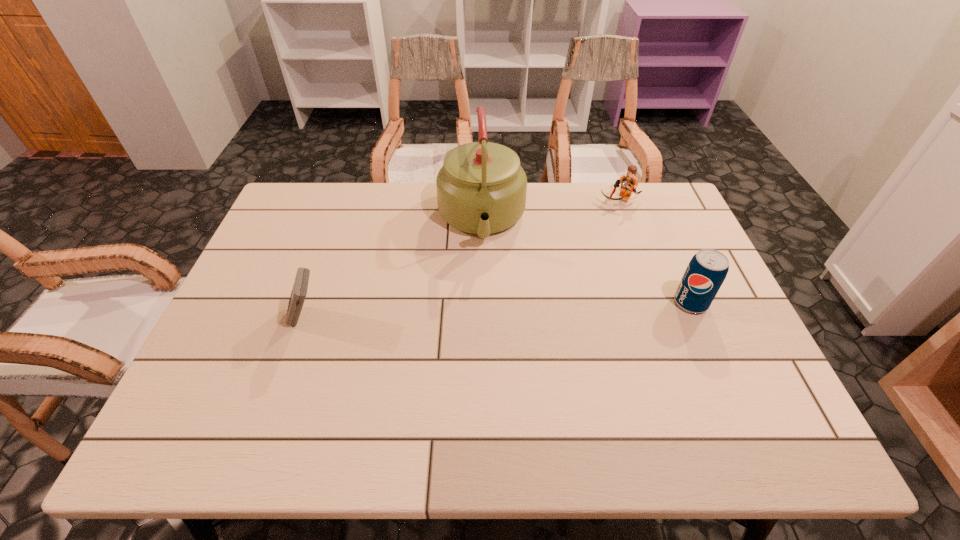
Locate an element on the screen. calculator is located at coordinates (299, 291).

At what (x,y) coordinates should I click in order to perform the action: click on pop. Please return your answer as a coordinate pair (x, y). Looking at the image, I should click on (707, 270).

This screenshot has height=540, width=960. I want to click on the third object from right to left, so click(x=481, y=188).

The width and height of the screenshot is (960, 540). In order to click on kettle in this screenshot , I will do `click(481, 188)`.

You are a GUI agent. You are given a task and a screenshot of the screen. Output one action in this format:
    pyautogui.click(x=<x>, y=<y>)
    Task: Click on the Lego
    
    Given the screenshot: What is the action you would take?
    pyautogui.click(x=629, y=182)

This screenshot has height=540, width=960. In order to click on free spot located 0.060m on the front-facing side of the calculator in this screenshot , I will do `click(264, 319)`.

You are a GUI agent. You are given a task and a screenshot of the screen. Output one action in this format:
    pyautogui.click(x=<x>, y=<y>)
    Task: Click on the free region located 0.090m on the front-facing side of the calculator
    
    Given the screenshot: What is the action you would take?
    pyautogui.click(x=252, y=319)

You are a GUI agent. You are given a task and a screenshot of the screen. Output one action in this format:
    pyautogui.click(x=<x>, y=<y>)
    Task: Click on the free location located 0.100m on the front-facing side of the calculator
    
    Given the screenshot: What is the action you would take?
    pyautogui.click(x=248, y=319)

Image resolution: width=960 pixels, height=540 pixels. What are the coordinates of `vacant space located on the back of the pop` in the screenshot? It's located at (665, 245).

Find the location of a particular element. free space located 0.060m at the spout of the second object from left to right is located at coordinates (485, 274).